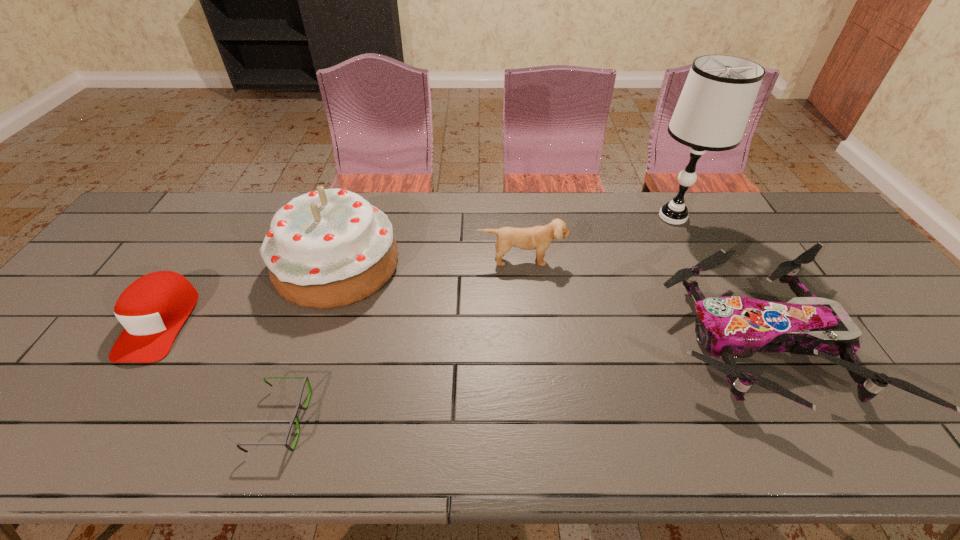
Identify the location of table lamp. This screenshot has height=540, width=960. (712, 112).

The height and width of the screenshot is (540, 960). Identify the location of cake. (329, 248).

Locate an element on the screen. The width and height of the screenshot is (960, 540). puppy is located at coordinates (539, 237).

You are a GUI agent. You are given a task and a screenshot of the screen. Output one action in this format:
    pyautogui.click(x=<x>, y=<y>)
    Task: Click on the third object from right to left
    
    Given the screenshot: What is the action you would take?
    pyautogui.click(x=539, y=237)

Locate an element on the screen. The height and width of the screenshot is (540, 960). drone is located at coordinates (731, 327).

Find the location of a particular element. Image resolution: width=960 pixels, height=540 pixels. the leftmost object is located at coordinates click(x=152, y=309).

Where is `the shortest object`? The image size is (960, 540). the shortest object is located at coordinates (298, 406).

Where is `vacant space situated 0.160m on the right of the table lamp`? vacant space situated 0.160m on the right of the table lamp is located at coordinates (752, 217).

The image size is (960, 540). Find the location of `free space located on the right of the cake`. free space located on the right of the cake is located at coordinates (482, 265).

You are a GUI agent. You are given a task and a screenshot of the screen. Output one action in this format:
    pyautogui.click(x=<x>, y=<y>)
    Task: Click on the free region located 0.260m on the left side of the puppy
    Image resolution: width=960 pixels, height=540 pixels.
    Given the screenshot: What is the action you would take?
    pyautogui.click(x=530, y=341)